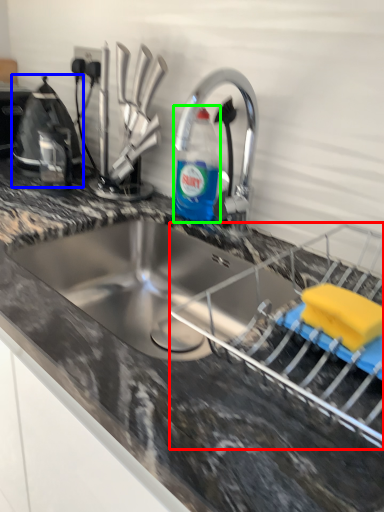
Question: Estimate the real-world distances between objects in this image. Which object is farther from appliance (highlighted by a red box), appliance (highlighted by a blue box) or bottle (highlighted by a green box)?

Choices:
 (A) appliance
 (B) bottle

Answer: (A)